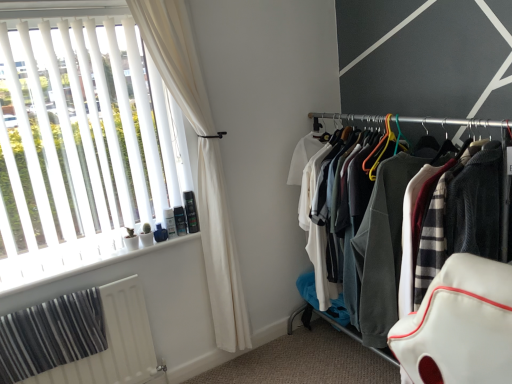
Question: Is textured fabric clothes at right positioned behind white plastic window sill at lower left?

Choices:
 (A) no
 (B) yes

Answer: (A)

Question: From the image's perspective, is textured fabric clothes at right on top of white plastic window sill at lower left?

Choices:
 (A) no
 (B) yes

Answer: (B)

Question: Would you consider textured fabric clothes at right to be distant from white plastic window sill at lower left?

Choices:
 (A) yes
 (B) no

Answer: (A)

Question: Considering the relative sizes of textured fabric clothes at right and white plastic window sill at lower left in the image provided, is textured fabric clothes at right shorter than white plastic window sill at lower left?

Choices:
 (A) yes
 (B) no

Answer: (B)

Question: Does textured fabric clothes at right have a smaller size compared to white plastic window sill at lower left?

Choices:
 (A) yes
 (B) no

Answer: (B)

Question: Does textured fabric clothes at right have a greater height compared to white plastic window sill at lower left?

Choices:
 (A) no
 (B) yes

Answer: (B)

Question: Is the depth of white textured radiator at lower left greater than that of white fabric curtain at left?

Choices:
 (A) yes
 (B) no

Answer: (A)

Question: Is white textured radiator at lower left at the left side of white fabric curtain at left?

Choices:
 (A) no
 (B) yes

Answer: (B)

Question: Is white textured radiator at lower left smaller than white fabric curtain at left?

Choices:
 (A) no
 (B) yes

Answer: (B)

Question: Can you confirm if white textured radiator at lower left is shorter than white fabric curtain at left?

Choices:
 (A) no
 (B) yes

Answer: (B)

Question: Does white textured radiator at lower left contain white fabric curtain at left?

Choices:
 (A) no
 (B) yes

Answer: (A)

Question: Does white textured radiator at lower left have a larger size compared to white fabric curtain at left?

Choices:
 (A) yes
 (B) no

Answer: (B)

Question: Could textured fabric clothes at right be considered to be inside white fabric curtain at left?

Choices:
 (A) yes
 (B) no

Answer: (B)